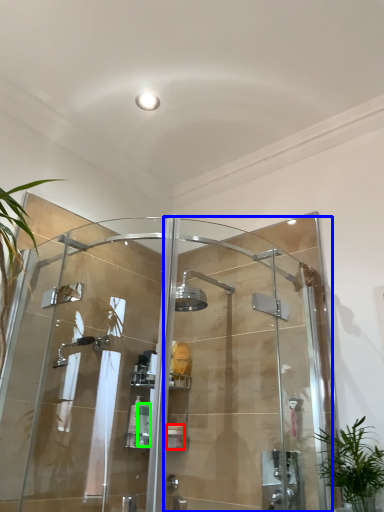
Question: Which object is the farthest from toiletry (highlighted by a red box)? Choose among these: screen door (highlighted by a blue box) or toiletry (highlighted by a green box).

Choices:
 (A) screen door
 (B) toiletry

Answer: (A)